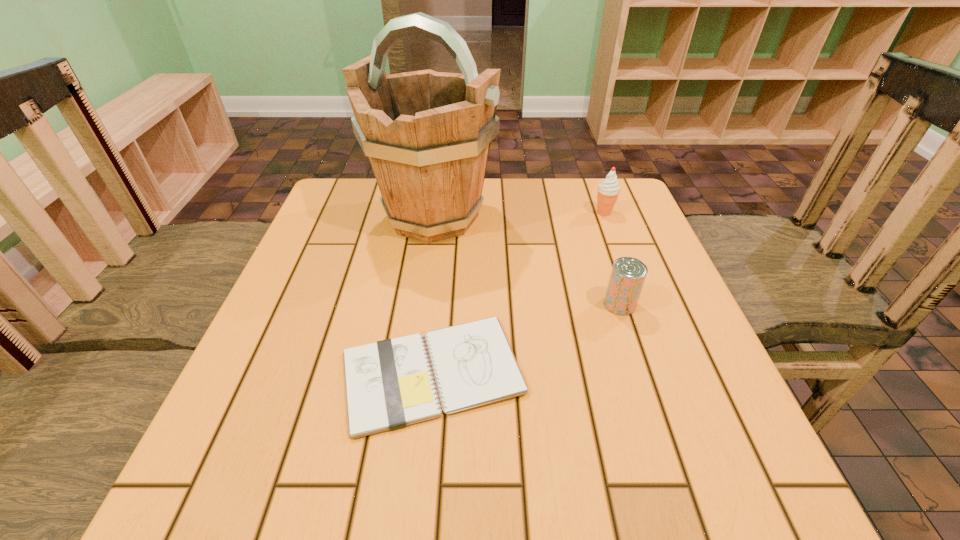
Image resolution: width=960 pixels, height=540 pixels. Identify the location of vacant space at the right edge of the desktop. (700, 352).

You are a GUI agent. You are given a task and a screenshot of the screen. Output one action in this format:
    pyautogui.click(x=<x>, y=<y>)
    Task: Click on the free space at the far left corner of the desktop
    
    Given the screenshot: What is the action you would take?
    pyautogui.click(x=346, y=212)

Locate an element on the screen. vacant space at the far right corner of the desktop is located at coordinates (646, 218).

This screenshot has height=540, width=960. What are the coordinates of `vacant space in between the icecream and the tallest object` in the screenshot? It's located at (518, 214).

I want to click on vacant point located between the second nearest object and the icecream, so click(612, 259).

This screenshot has width=960, height=540. What are the coordinates of `vacant space that's between the third farthest object and the icecream` in the screenshot? It's located at (612, 259).

This screenshot has height=540, width=960. What are the coordinates of `free space between the bucket and the icecream` in the screenshot? It's located at (518, 214).

The height and width of the screenshot is (540, 960). What are the coordinates of `free spot between the tallest object and the nearest object` in the screenshot? It's located at (433, 294).

This screenshot has height=540, width=960. What are the coordinates of `free space that is in between the shortest object and the icecream` in the screenshot? It's located at (518, 293).

The width and height of the screenshot is (960, 540). I want to click on empty space that is in between the third shortest object and the bucket, so click(x=518, y=214).